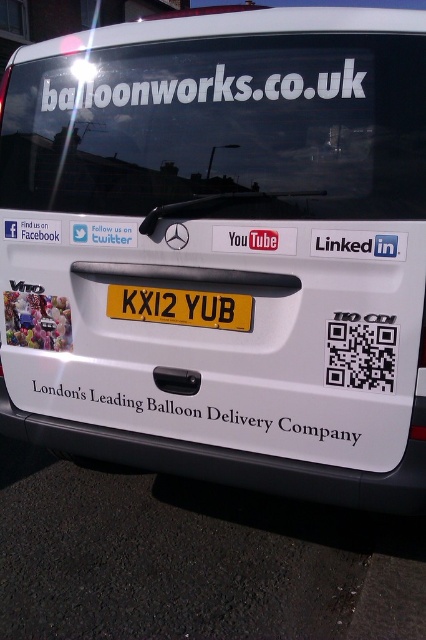
In the scene shown: You are a delivery driver who needs to read the license plate of the van. You see the transparent glass windshield at upper center and the white matte text at center. Which object is closer to the left side of the van?

The white matte text at center is closer to the left side of the van because the transparent glass windshield at upper center is to the right of it.

You are standing directly behind the van and looking at its rear. There is a point marked at coordinate (221, 128). What object is located at this point?

The point at coordinate (221, 128) marks the transparent glass windshield at upper center.

You are standing in front of the van and want to locate two points on its rear door. The first point is at coordinates point (189,131) and the second is at point (212,240). Which point is closer to the front of the van?

Point (212,240) is closer to the front of the van because it is in front of point (189,131), which is behind it.